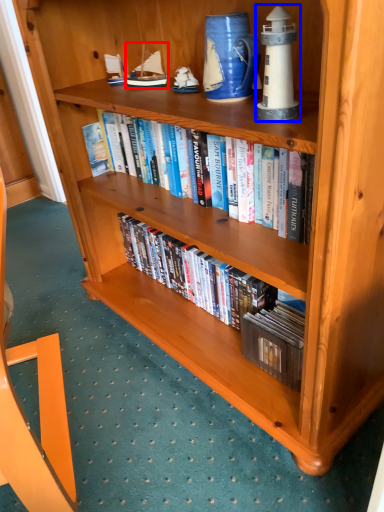
Question: Which of the following is the farthest to the observer, toy (highlighted by a red box) or toy (highlighted by a blue box)?

Choices:
 (A) toy
 (B) toy

Answer: (A)